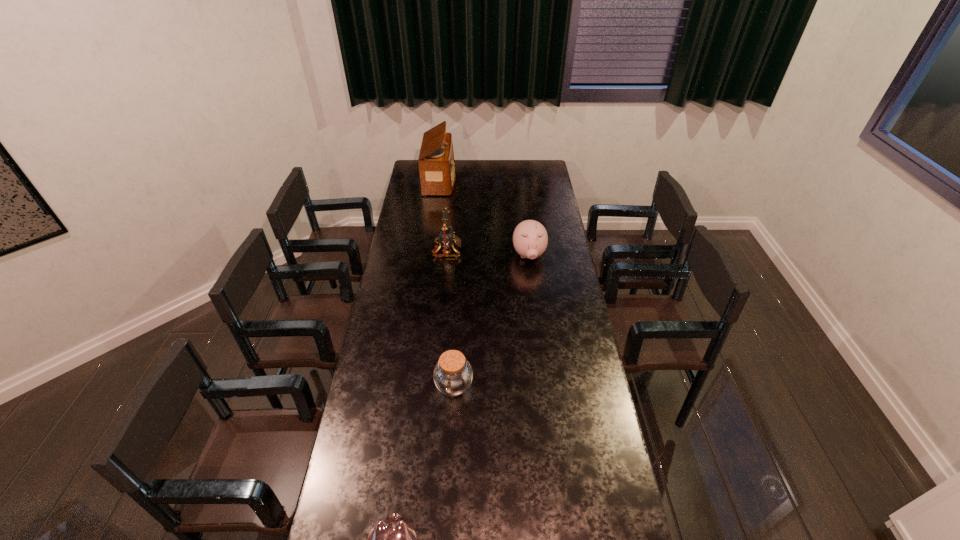
Find the location of a particular element. This screenshot has width=960, height=540. free space between the farther piggy bank and the radio receiver is located at coordinates (485, 218).

You are a GUI agent. You are given a task and a screenshot of the screen. Output one action in this format:
    pyautogui.click(x=<x>, y=<y>)
    Task: Click on the vacant area that lies between the taller piggy bank and the jar
    The image size is (960, 540).
    Given the screenshot: What is the action you would take?
    pyautogui.click(x=492, y=321)

Choose which object is the second nearest neighbor to the taller piggy bank. Please provide its 2D coordinates. Your answer should be formatted as a tuple, i.e. [(x, y)], where the tuple contains the x and y coordinates of a point satisfying the conditions above.

[(436, 163)]

Select which object appears as the third closest to the nearer piggy bank. Please provide its 2D coordinates. Your answer should be formatted as a tuple, i.e. [(x, y)], where the tuple contains the x and y coordinates of a point satisfying the conditions above.

[(446, 238)]

The width and height of the screenshot is (960, 540). I want to click on vacant space that satisfies the following two spatial constraints: 1. on the front of the fourth shortest object, featuring the rotary dial; 2. on the left side of the fourth farthest object, so coord(435,386).

You are a GUI agent. You are given a task and a screenshot of the screen. Output one action in this format:
    pyautogui.click(x=<x>, y=<y>)
    Task: Click on the vacant space that satisfies the following two spatial constraints: 1. on the front panel of the jar; 2. on the right side of the radio receiver
    This screenshot has width=960, height=540.
    Given the screenshot: What is the action you would take?
    pyautogui.click(x=414, y=386)

Image resolution: width=960 pixels, height=540 pixels. What are the coordinates of `vacant space that satisfies the following two spatial constraints: 1. on the front panel of the radio receiver; 2. on the left side of the second nearest object` in the screenshot? It's located at (414, 386).

Image resolution: width=960 pixels, height=540 pixels. I want to click on blank space that satisfies the following two spatial constraints: 1. on the back side of the second nearest object; 2. on the front of the telephone, featuring the rotary dial, so click(461, 251).

Find the location of a particular element. vacant region that satisfies the following two spatial constraints: 1. on the front panel of the tallest object; 2. on the back side of the fourth farthest object is located at coordinates (414, 386).